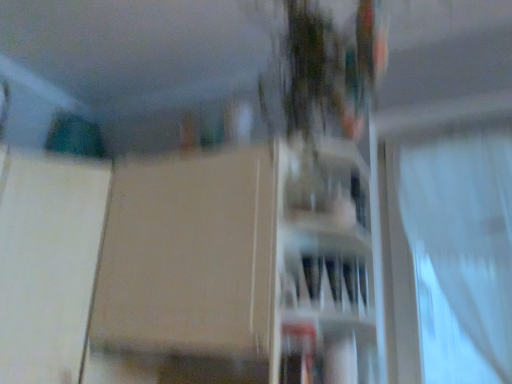
Question: From a real-world perspective, is matte white vase at center physically below white sheer curtain at right?

Choices:
 (A) no
 (B) yes

Answer: (A)

Question: From the image's perspective, is matte white vase at center on white sheer curtain at right?

Choices:
 (A) no
 (B) yes

Answer: (B)

Question: Considering the relative sizes of matte white vase at center and white sheer curtain at right in the image provided, is matte white vase at center wider than white sheer curtain at right?

Choices:
 (A) yes
 (B) no

Answer: (A)

Question: Can you confirm if matte white vase at center is smaller than white sheer curtain at right?

Choices:
 (A) yes
 (B) no

Answer: (A)

Question: Can you confirm if matte white vase at center is positioned to the right of white sheer curtain at right?

Choices:
 (A) no
 (B) yes

Answer: (A)

Question: Choose the correct answer: Is white matte screen door at left inside white sheer curtain at right or outside it?

Choices:
 (A) outside
 (B) inside

Answer: (A)

Question: Considering the positions of white matte screen door at left and white sheer curtain at right in the image, is white matte screen door at left taller or shorter than white sheer curtain at right?

Choices:
 (A) short
 (B) tall

Answer: (A)

Question: From a real-world perspective, is white matte screen door at left positioned above or below white sheer curtain at right?

Choices:
 (A) below
 (B) above

Answer: (A)

Question: Looking at their shapes, would you say white matte screen door at left is wider or thinner than white sheer curtain at right?

Choices:
 (A) thin
 (B) wide

Answer: (B)

Question: In the image, is white sheer curtain at right positioned in front of or behind matte white vase at center?

Choices:
 (A) front
 (B) behind

Answer: (B)

Question: From their relative heights in the image, would you say white sheer curtain at right is taller or shorter than matte white vase at center?

Choices:
 (A) tall
 (B) short

Answer: (A)

Question: From the image's perspective, is white sheer curtain at right positioned above or below matte white vase at center?

Choices:
 (A) below
 (B) above

Answer: (A)

Question: From a real-world perspective, relative to matte white vase at center, is white sheer curtain at right vertically above or below?

Choices:
 (A) below
 (B) above

Answer: (A)

Question: Based on their positions, is matte white vase at center located to the left or right of transparent glass window at upper right?

Choices:
 (A) right
 (B) left

Answer: (B)

Question: Looking at the image, does matte white vase at center seem bigger or smaller compared to transparent glass window at upper right?

Choices:
 (A) small
 (B) big

Answer: (B)